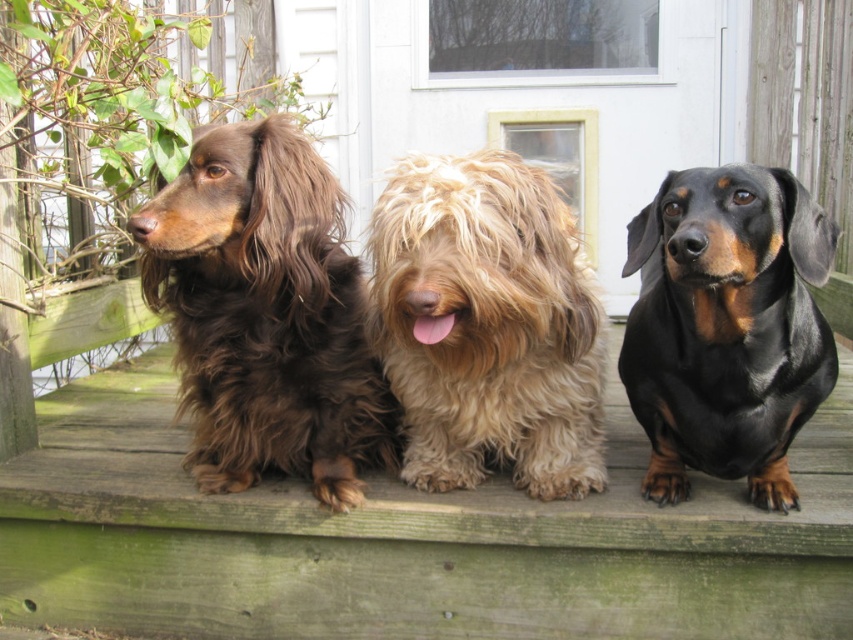
Question: Estimate the real-world distances between objects in this image. Which object is closer to the black shiny dog at center?

Choices:
 (A) shiny brown fur at center
 (B) fuzzy brown dog at center

Answer: (B)

Question: Which object is farther from the camera taking this photo?

Choices:
 (A) fuzzy brown dog at center
 (B) shiny brown fur at center

Answer: (B)

Question: Which of these objects is positioned farthest from the black shiny dog at center?

Choices:
 (A) fuzzy brown dog at center
 (B) shiny brown fur at center

Answer: (B)

Question: Is fuzzy brown dog at center to the left of black shiny dog at center from the viewer's perspective?

Choices:
 (A) yes
 (B) no

Answer: (A)

Question: Can you confirm if fuzzy brown dog at center is positioned to the left of black shiny dog at center?

Choices:
 (A) no
 (B) yes

Answer: (B)

Question: Does fuzzy brown dog at center have a larger size compared to black shiny dog at center?

Choices:
 (A) no
 (B) yes

Answer: (A)